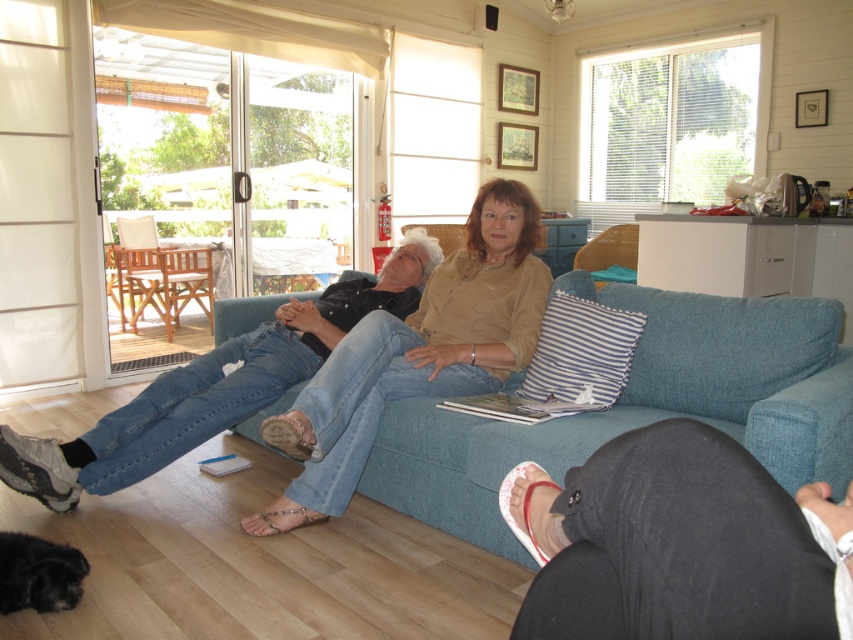
You are a tailor measuring the height of two pairs of denim jeans in the living room. The denim jeans at center and denim jeans at left are both visible. Which pair of denim jeans is taller?

The denim jeans at center is taller than denim jeans at left.

You are standing at the sliding glass doors and want to walk to the point at the bottom of the room. Which point, point (450,385) or point (3,538), is closer to the sliding glass doors?

Point (3,538) is closer to the sliding glass doors because it is positioned lower in the room compared to point (450,385), which is behind it.

You are standing in the living room and want to sit down on the blue fabric couch at center. If your legs are 3 feet long, will you be able to comfortably stretch them out while sitting on the couch?

The blue fabric couch at center is 5.04 feet away from the camera. Since your legs are 3 feet long, you should have enough space to comfortably stretch them out while sitting on the couch.